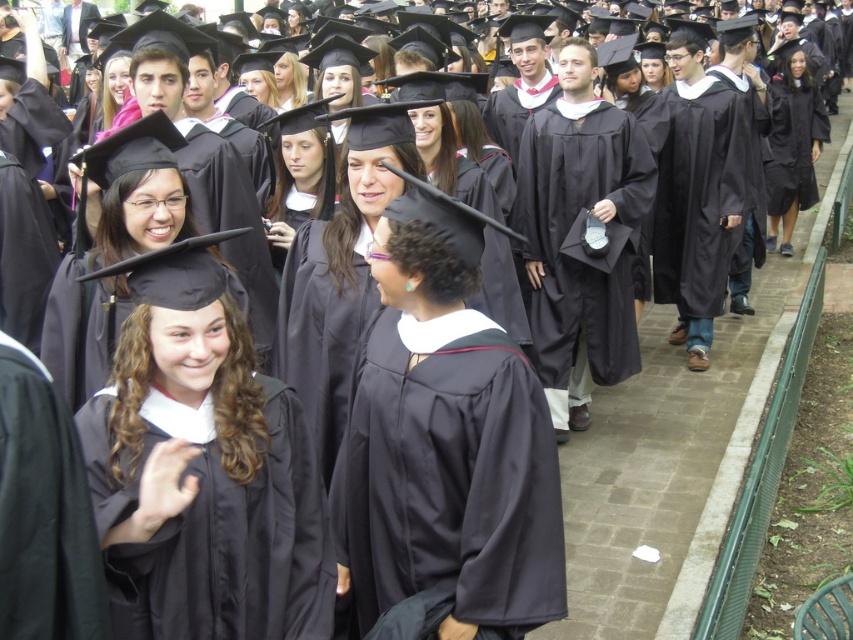
You are a photographer at the graduation ceremony. You want to capture a photo that includes both the matte black gown at center and the black matte graduation gown at lower left without any obstructions. Given their heights, which gown should be positioned closer to the front of the frame to ensure both are fully visible?

The matte black gown at center is taller than the black matte graduation gown at lower left. To ensure both are fully visible without obstructions, the shorter black matte graduation gown at lower left should be placed closer to the front of the frame.

You are standing at the center of the graduation ceremony scene. You see a point marked at coordinates point (236, 547). What object is this point located on?

The point (236, 547) is located on the matte black gown at lower left.

You are a photographer at the graduation ceremony. You need to capture a photo that includes both the matte black gown at lower left and the matte black gown at center. Which gown should you focus on first to ensure both are in frame?

The matte black gown at lower left is smaller in size compared to the matte black gown at center. To ensure both are in frame, focus on the larger matte black gown at center first, then adjust the camera angle to include the smaller one.